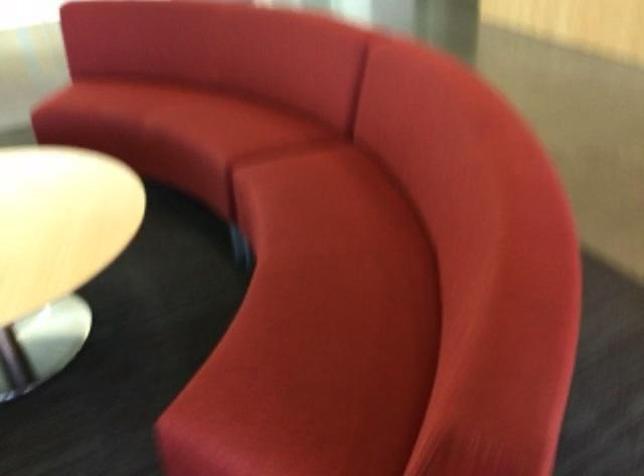
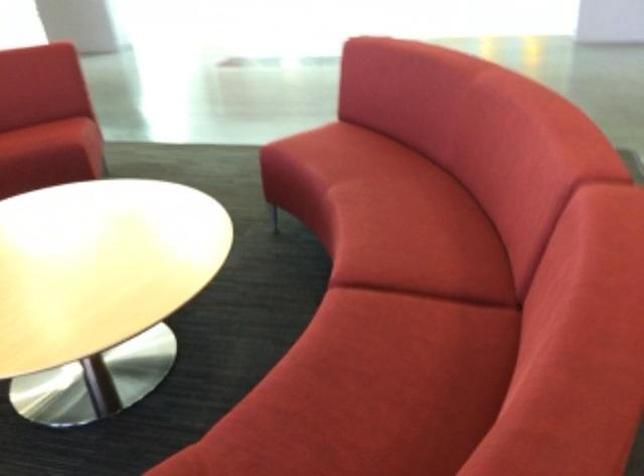
The point at (259,128) is marked in the first image. Where is the corresponding point in the second image?

(418, 239)